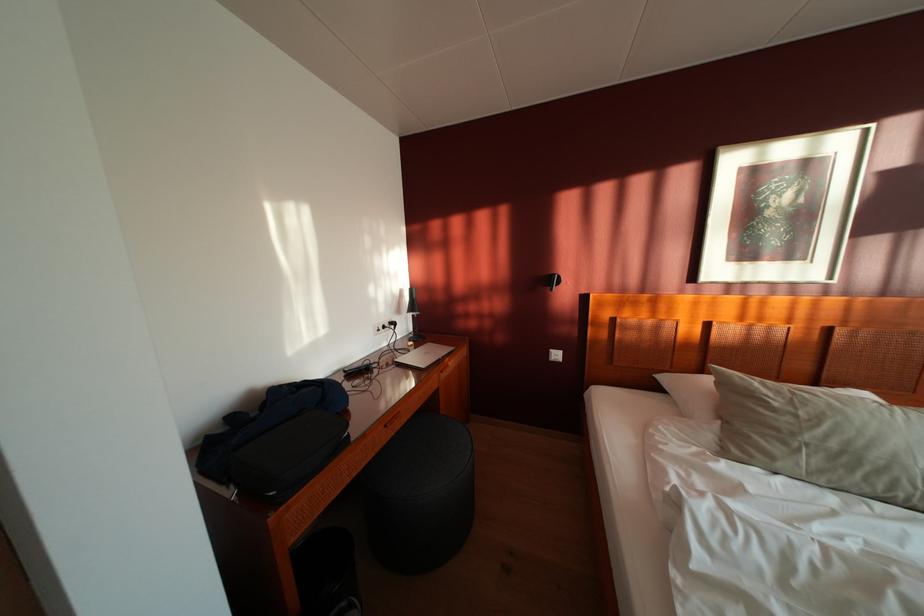
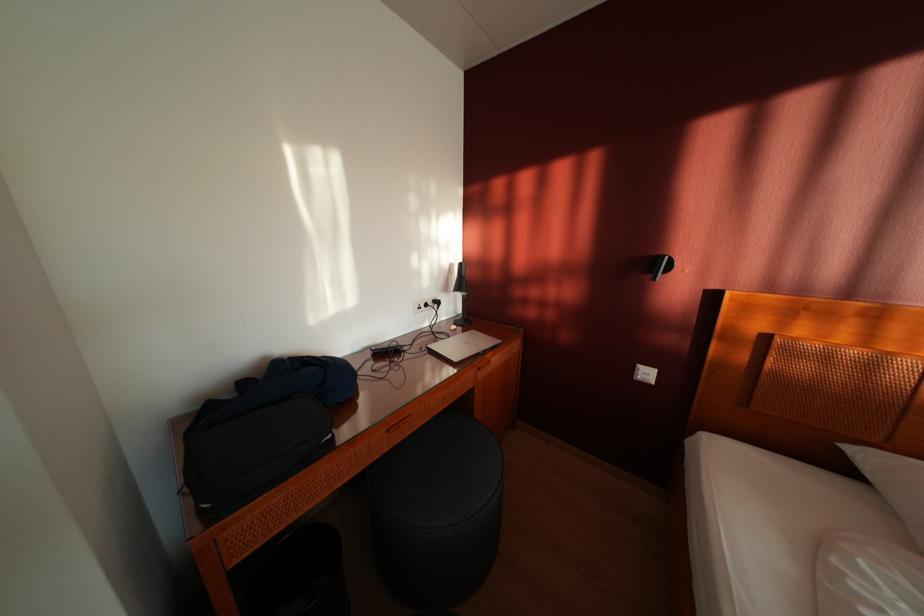
Question: The images are taken continuously from a first-person perspective. In which direction are you moving?

Choices:
 (A) Left
 (B) Right
 (C) Forward
 (D) Backward

Answer: (C)